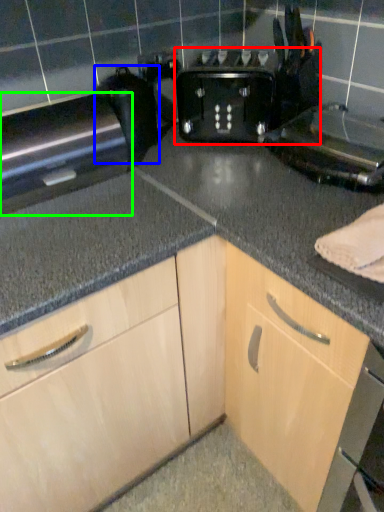
Question: Considering the real-world distances, which object is farthest from toaster (highlighted by a red box)? appliance (highlighted by a blue box) or appliance (highlighted by a green box)?

Choices:
 (A) appliance
 (B) appliance

Answer: (B)